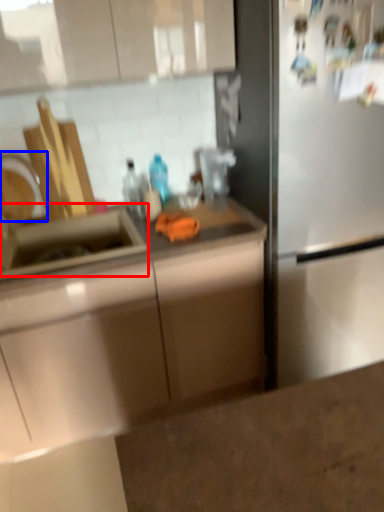
Question: Which object appears closest to the camera in this image, sink (highlighted by a red box) or faucet (highlighted by a blue box)?

Choices:
 (A) sink
 (B) faucet

Answer: (A)